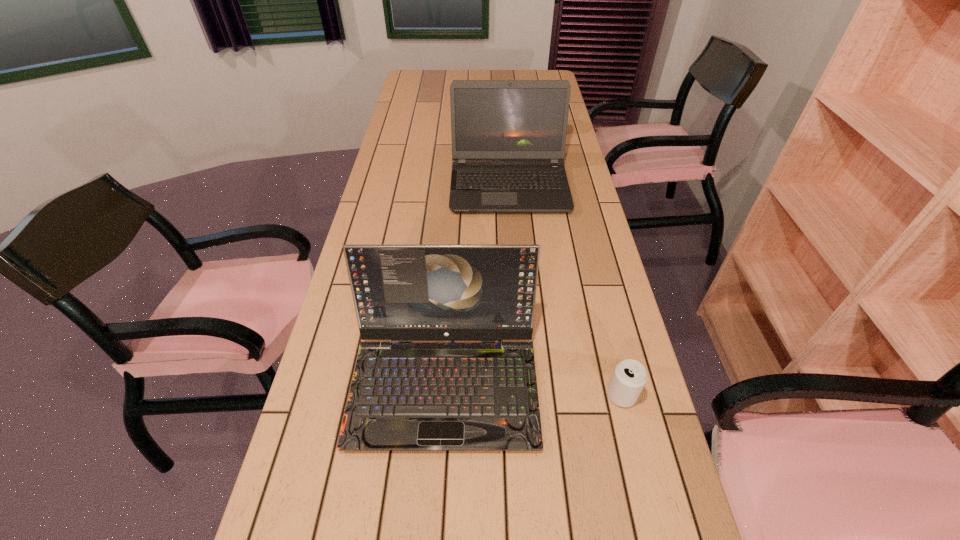
Where is `the farther laptop computer`? the farther laptop computer is located at coordinates (512, 133).

Locate an element on the screen. the nearer laptop computer is located at coordinates [x=405, y=396].

Find the location of a particular element. The height and width of the screenshot is (540, 960). the shortest object is located at coordinates (629, 377).

The height and width of the screenshot is (540, 960). In order to click on free space located on the screen of the farther laptop computer in this screenshot , I will do `click(514, 241)`.

At what (x,y) coordinates should I click in order to perform the action: click on vacant area situated on the screen of the nearer laptop computer. Please return your answer as a coordinate pair (x, y). The width and height of the screenshot is (960, 540). Looking at the image, I should click on (439, 480).

The width and height of the screenshot is (960, 540). I want to click on vacant point located on the front of the can, so click(633, 441).

The height and width of the screenshot is (540, 960). I want to click on object present at the left edge, so pos(405,396).

Image resolution: width=960 pixels, height=540 pixels. In order to click on laptop_computer positioned at the right edge in this screenshot , I will do `click(512, 133)`.

Identify the location of can present at the right edge. This screenshot has height=540, width=960. (629, 377).

You are a GUI agent. You are given a task and a screenshot of the screen. Output one action in this format:
    pyautogui.click(x=<x>, y=<y>)
    Task: Click on the free region at the far edge of the desktop
    This screenshot has height=540, width=960.
    Given the screenshot: What is the action you would take?
    (466, 79)